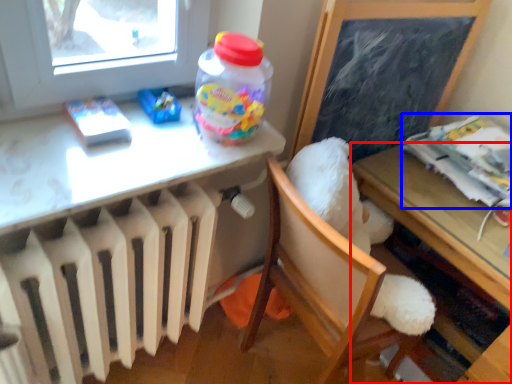
Question: Which object is further to the camera taking this photo, table (highlighted by a red box) or magazine (highlighted by a blue box)?

Choices:
 (A) table
 (B) magazine

Answer: (B)